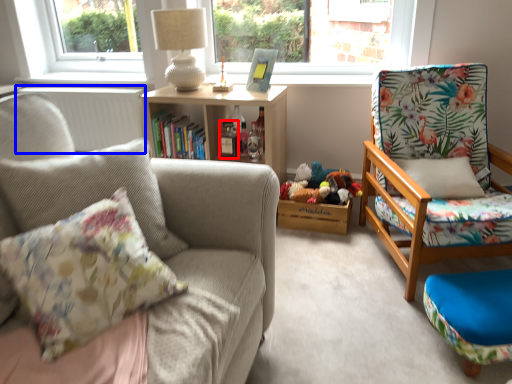
Question: Which object appears closest to the camera in this image, bottle (highlighted by a red box) or radiator (highlighted by a blue box)?

Choices:
 (A) bottle
 (B) radiator

Answer: (A)